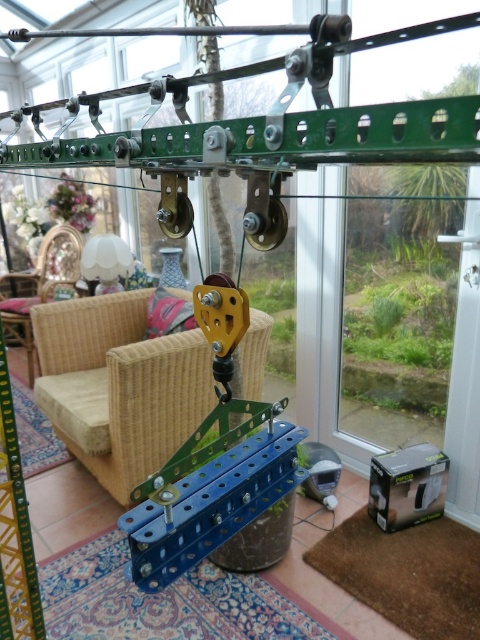
Question: Which object is positioned farthest from the metallic blue pulley at center?

Choices:
 (A) rattan armchair at center
 (B) wicker armchair at center

Answer: (B)

Question: Among these points, which one is nearest to the camera?

Choices:
 (A) (7, 282)
 (B) (210, 513)

Answer: (B)

Question: Can you confirm if rattan armchair at center is positioned below metallic blue pulley at center?

Choices:
 (A) yes
 (B) no

Answer: (A)

Question: Which object is positioned farthest from the wicker armchair at center?

Choices:
 (A) rattan armchair at center
 (B) metallic blue pulley at center

Answer: (B)

Question: Is rattan armchair at center smaller than metallic blue pulley at center?

Choices:
 (A) no
 (B) yes

Answer: (A)

Question: Considering the relative positions of rattan armchair at center and metallic blue pulley at center in the image provided, where is rattan armchair at center located with respect to metallic blue pulley at center?

Choices:
 (A) below
 (B) above

Answer: (A)